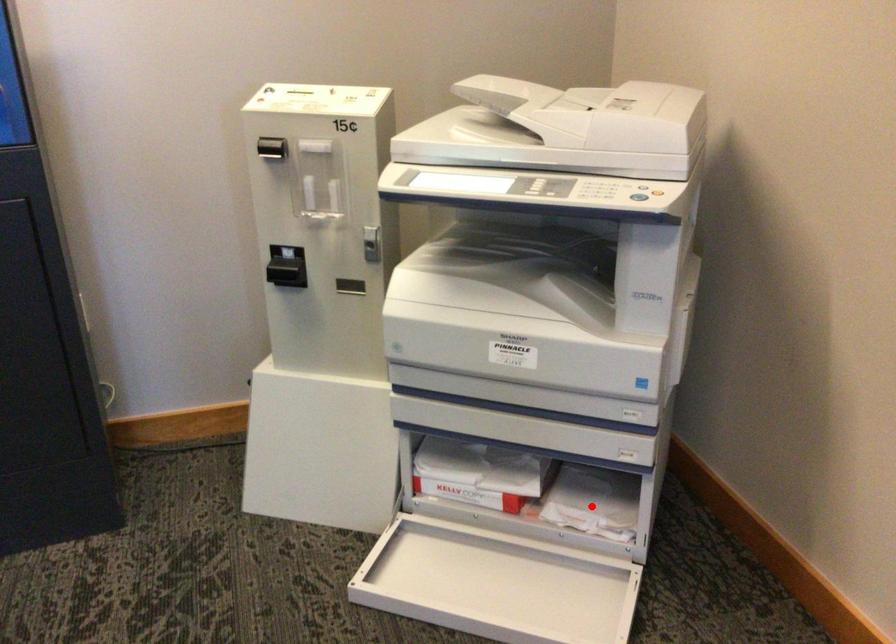
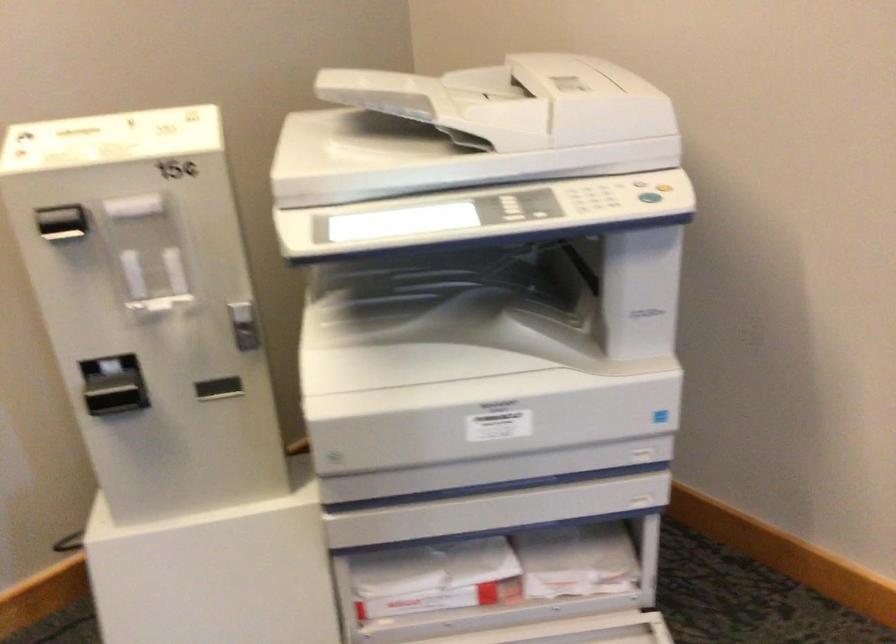
Question: I am providing you with two images of the same scene from different viewpoints. Image1 has a red point marked. In image2, the corresponding 3D location appears at what relative position? Reply with the corresponding letter.

Choices:
 (A) Closer
 (B) Farther

Answer: (A)